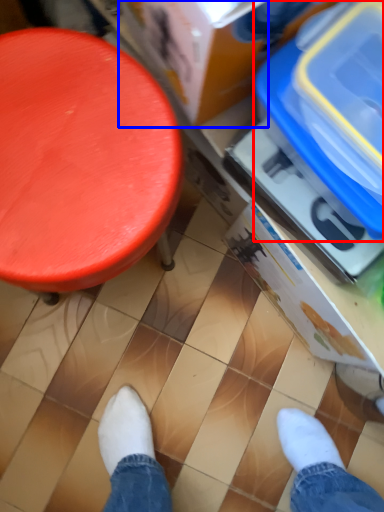
Question: Which object appears farthest to the camera in this image, storage box (highlighted by a red box) or storage box (highlighted by a blue box)?

Choices:
 (A) storage box
 (B) storage box

Answer: (A)